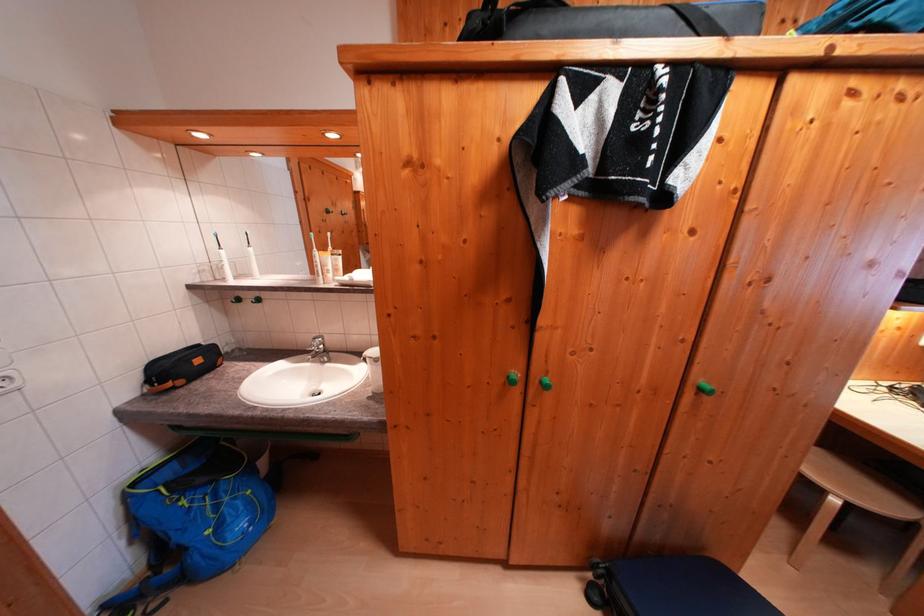
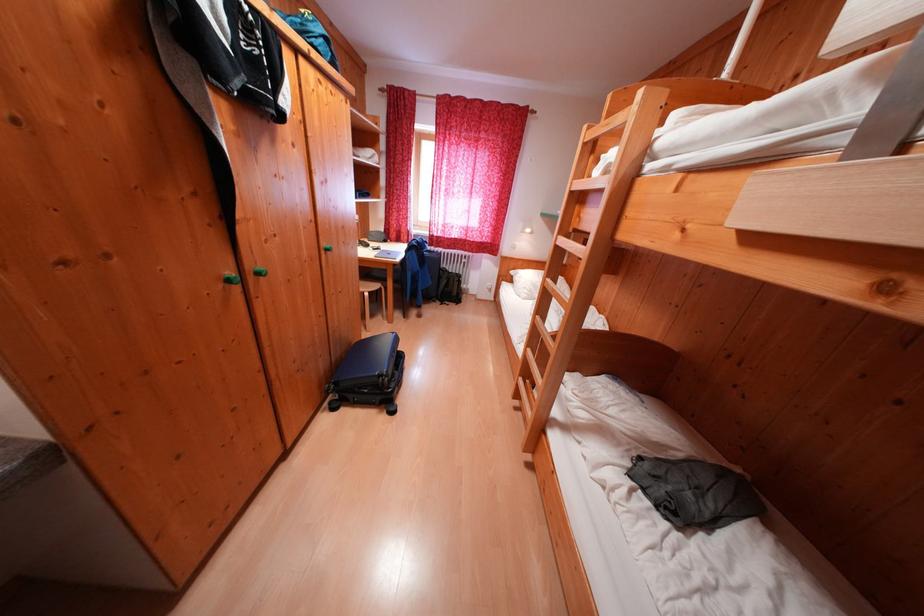
In the second image, find the point that corresponds to [896,509] in the first image.

(383, 290)